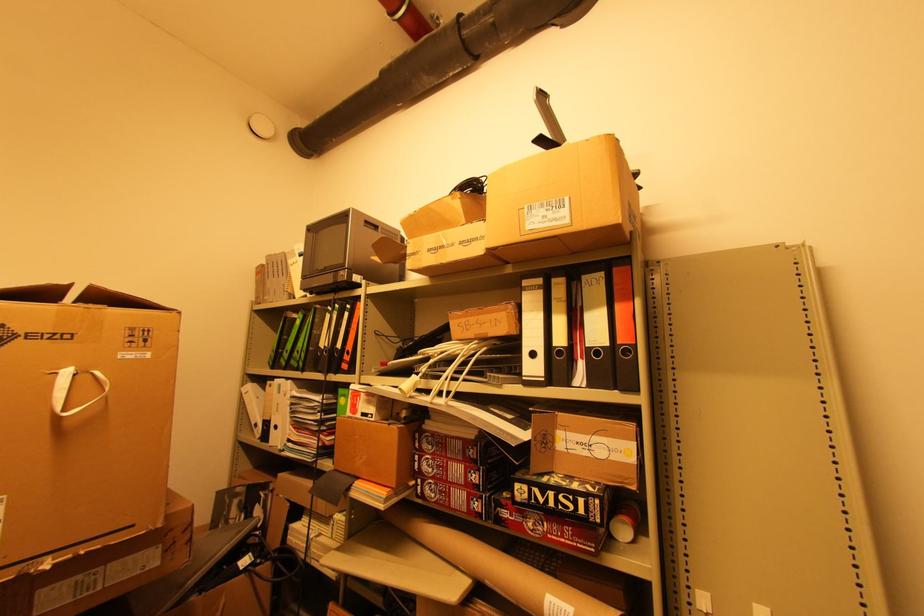
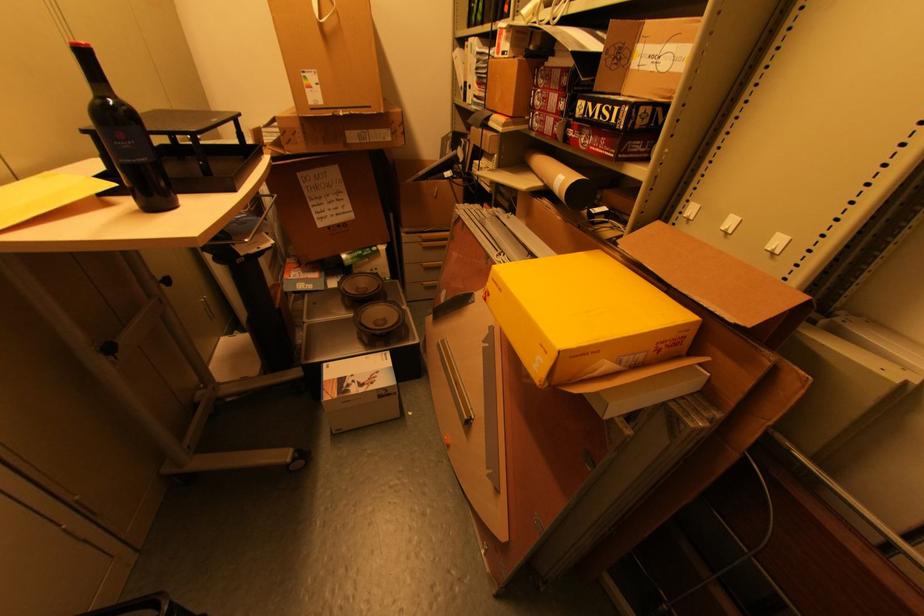
Where in the second image is the point corresponding to point (560, 536) from the first image?

(599, 148)